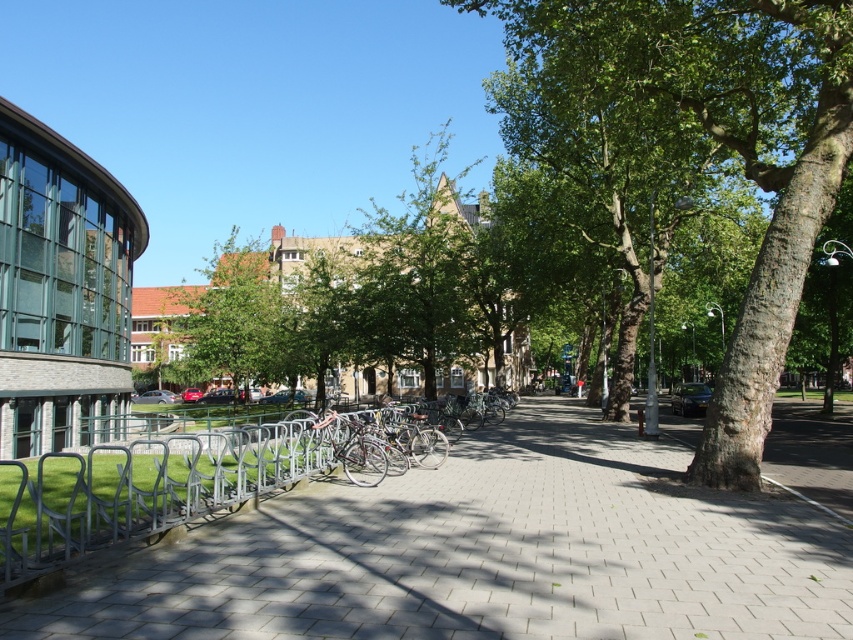
You are a city planner assessing the park layout. You need to determine if the green rough bark tree at center will block the view of the silver metallic bike rack at left from the main entrance. Based on their heights, can you conclude anything about their visibility?

The green rough bark tree at center is taller than the silver metallic bike rack at left. Since the tree is taller, it may block the view of the bike rack depending on their positions and the line of sight from the entrance.

You are standing at the point labeled point (802,35). You want to walk to the point labeled point 0.944, 0.059. The path is 12.17 meters long. If you walk at a speed of 1.5 meters per second, how many seconds will it take you to reach your destination?

The path between the two points is 12.17 meters long. At a walking speed of 1.5 meters per second, it will take approximately 8.11 seconds to reach the destination.